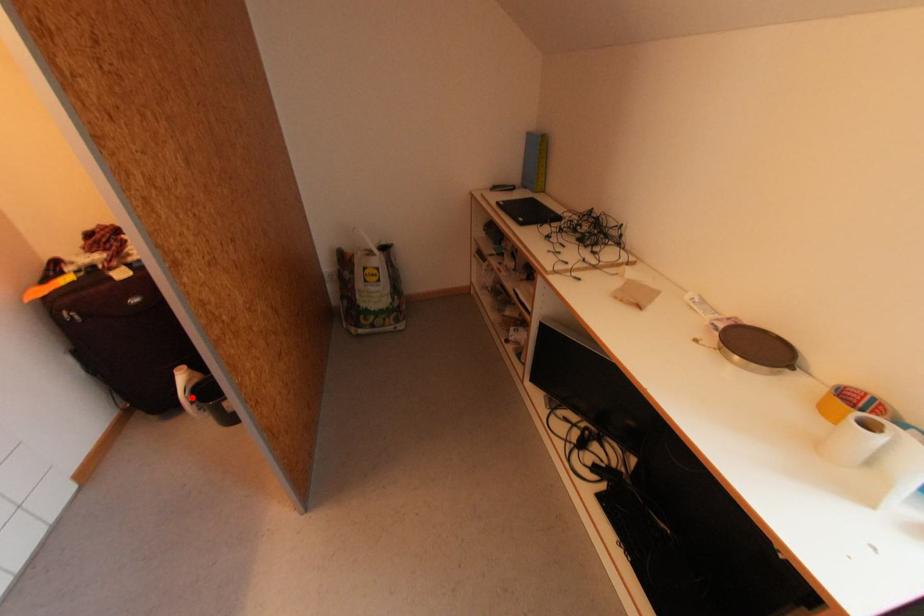
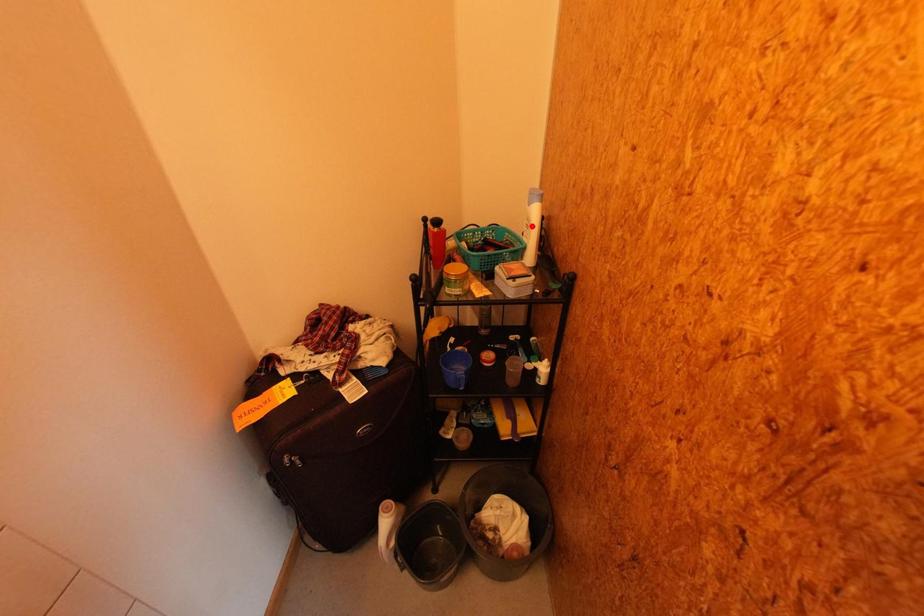
I am providing you with two images of the same scene from different viewpoints. A red point is marked on the first image and another point is marked on the second image. Is the marked point in image1 the same physical position as the marked point in image2?

No